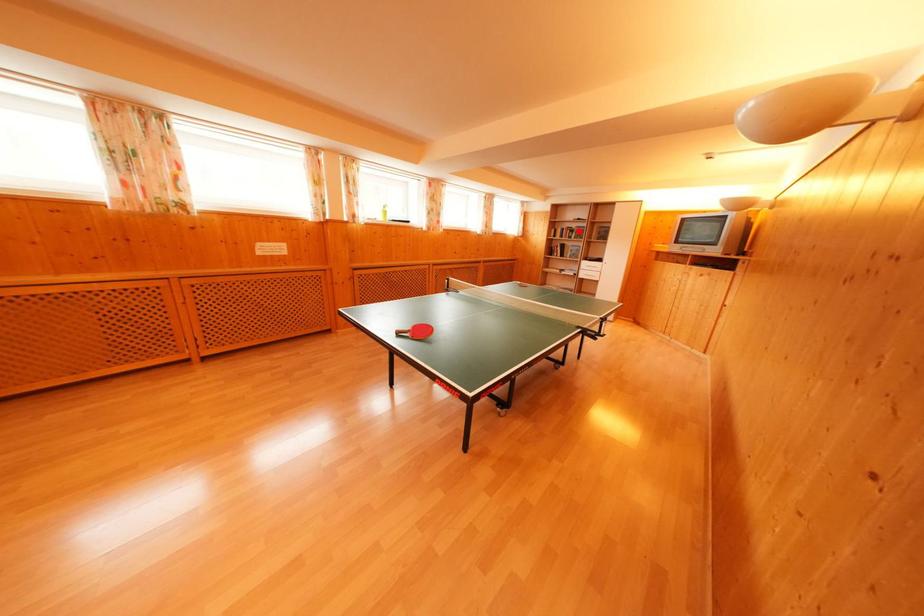
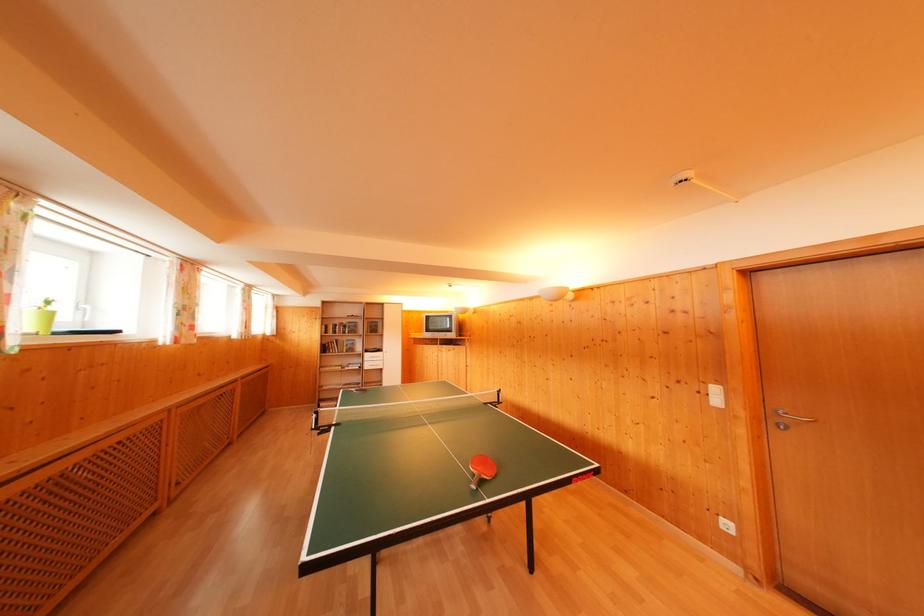
In the second image, find the point that corresponds to the highlighted location in the first image.

(349, 326)